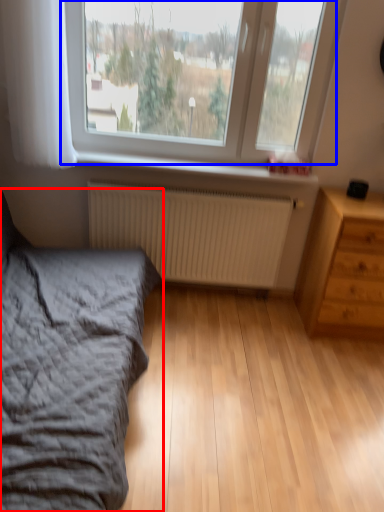
Question: Which object is further to the camera taking this photo, bed (highlighted by a red box) or window (highlighted by a blue box)?

Choices:
 (A) bed
 (B) window

Answer: (B)